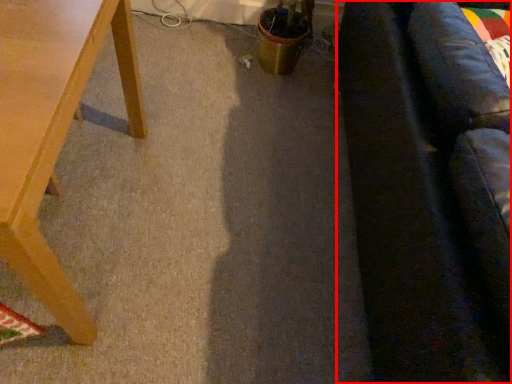
Question: Observing the image, what is the correct spatial positioning of couch (annotated by the red box) in reference to table?

Choices:
 (A) left
 (B) right

Answer: (B)